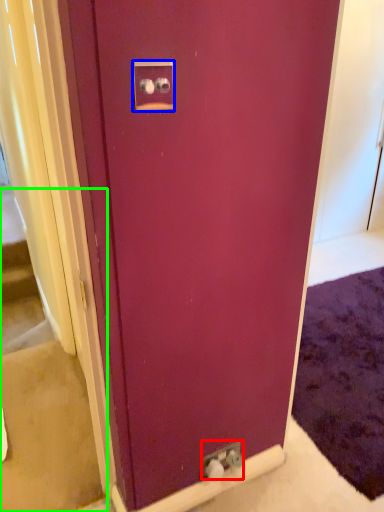
Question: Which is nearer to the electric outlet (highlighted by a red box)? electric outlet (highlighted by a blue box) or stairwell (highlighted by a green box).

Choices:
 (A) electric outlet
 (B) stairwell

Answer: (B)